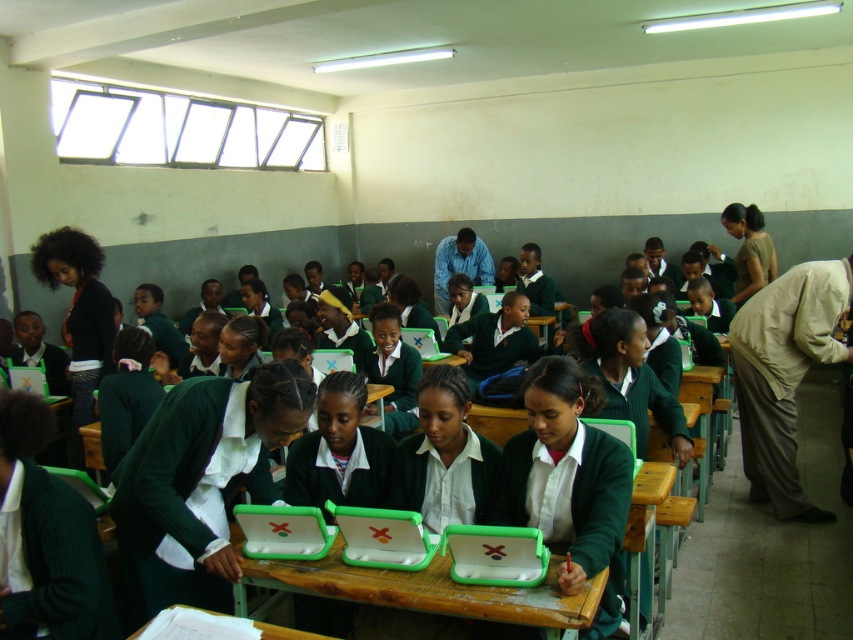
In the classroom scene, you notice a wooden desk at center and a green matte laptop at center. Which object is shorter?

The wooden desk at center has a lesser height compared to the green matte laptop at center, so the wooden desk at center is shorter.

In the classroom scene, there are two types of laptops at the center area. The green plastic laptops at center and the green matte laptop at center. Which one is wider?

The green plastic laptops at center are wider than the green matte laptop at center.